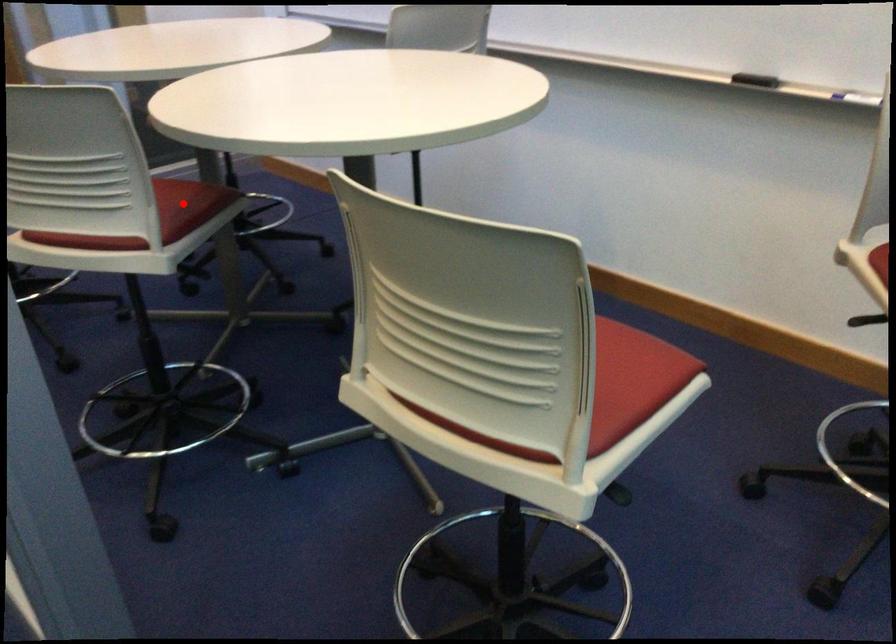
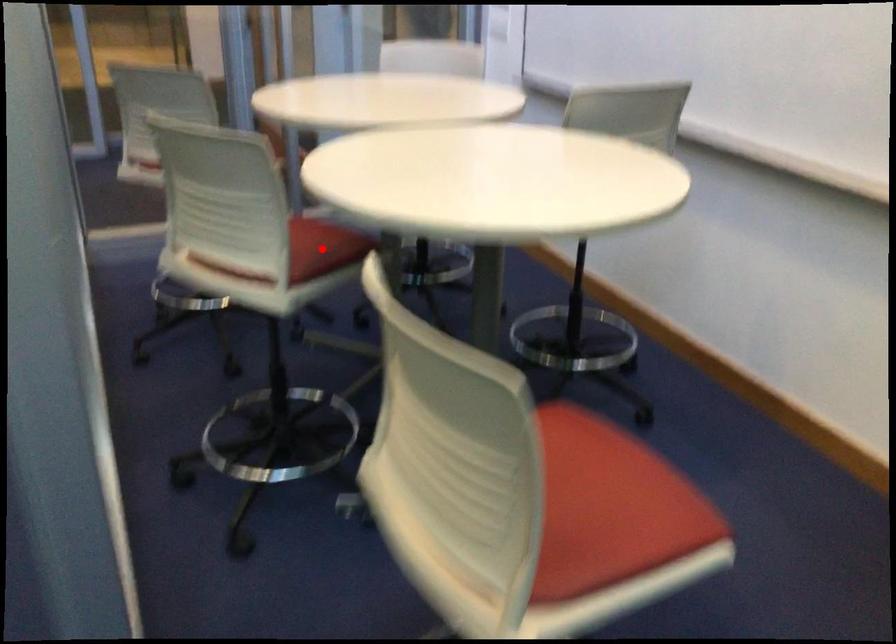
I am providing you with two images of the same scene from different viewpoints. A red point is marked on the first image and another point is marked on the second image. Are the points marked in image1 and image2 representing the same 3D position?

Yes